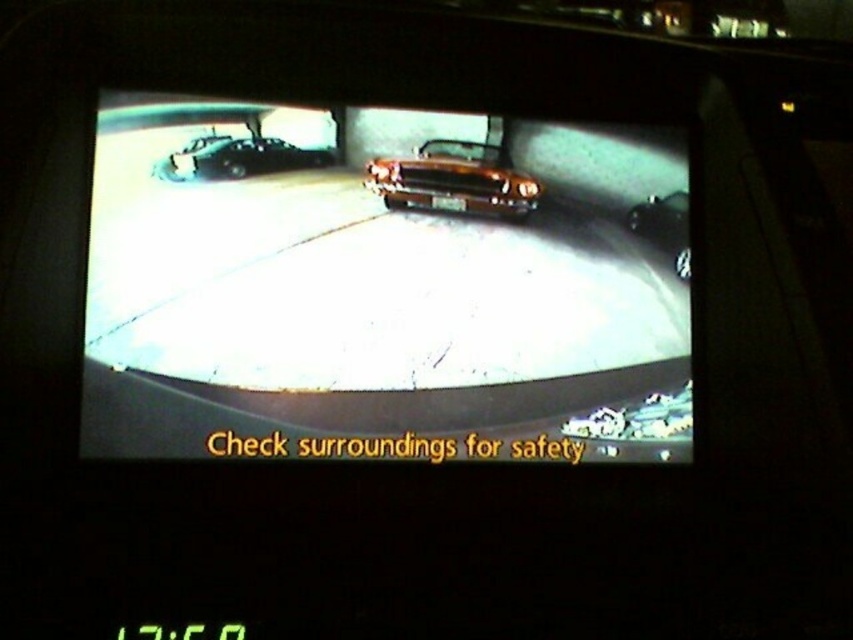
Question: Which point appears closest to the camera in this image?

Choices:
 (A) (215, 147)
 (B) (619, 288)
 (C) (392, 200)
 (D) (641, 230)

Answer: (A)

Question: Which of the following is the closest to the observer?

Choices:
 (A) shiny chrome car at center
 (B) glossy metallic car at right
 (C) shiny brown car at center

Answer: (A)

Question: Where is shiny brown car at center located in relation to glossy metallic car at right in the image?

Choices:
 (A) left
 (B) right

Answer: (A)

Question: Does shiny black car at left have a smaller size compared to glossy metallic car at right?

Choices:
 (A) yes
 (B) no

Answer: (B)

Question: Does shiny chrome car at center appear on the right side of shiny brown car at center?

Choices:
 (A) yes
 (B) no

Answer: (B)

Question: Estimate the real-world distances between objects in this image. Which object is farther from the glossy metallic car at right?

Choices:
 (A) shiny chrome car at center
 (B) shiny brown car at center

Answer: (A)